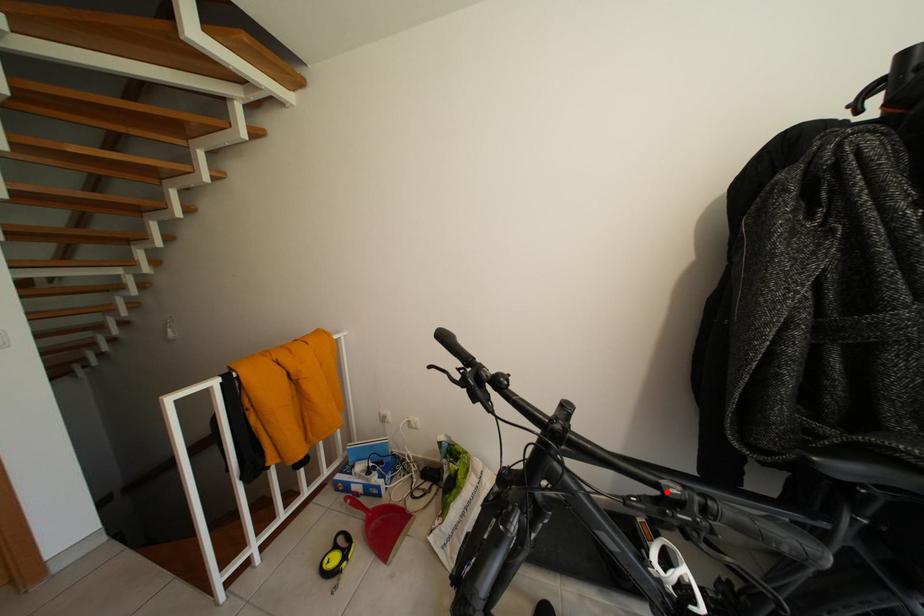
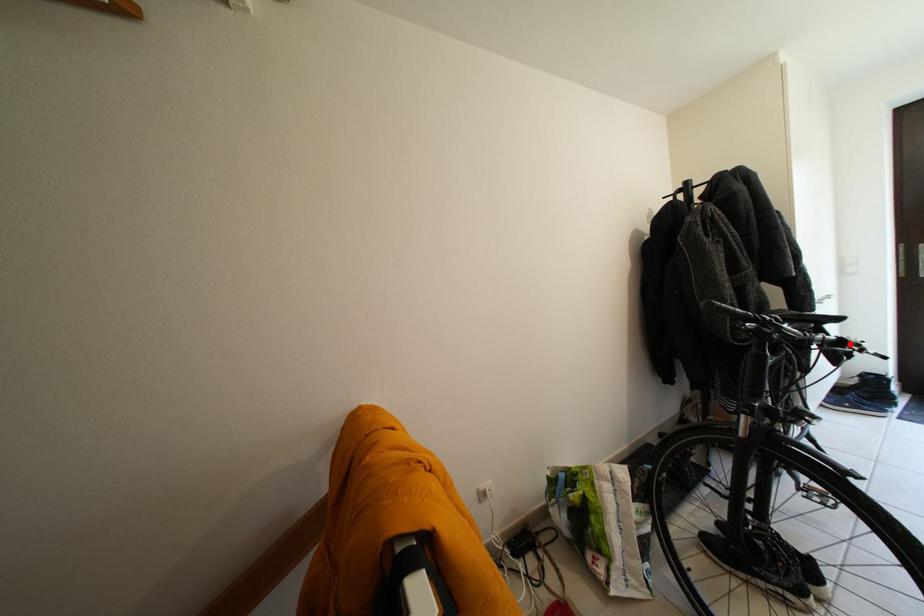
I am providing you with two images of the same scene from different viewpoints. A red point is marked on the first image and another point is marked on the second image. Do the highlighted points in image1 and image2 indicate the same real-world spot?

Yes